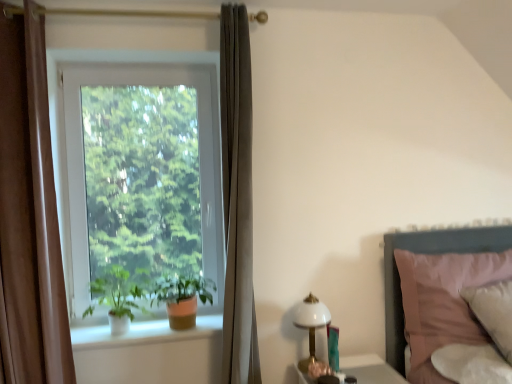
Question: From the image's perspective, is pink fabric bed at right above or below white matte plant at window, the first houseplant when ordered from left to right?

Choices:
 (A) above
 (B) below

Answer: (B)

Question: Is pink fabric bed at right wider or thinner than white matte plant at window, which is the second houseplant in right-to-left order?

Choices:
 (A) wide
 (B) thin

Answer: (B)

Question: Estimate the real-world distances between objects in this image. Which object is farther from the brown velvet curtain at left?

Choices:
 (A) white plastic window at left
 (B) pink fabric bed at right
 (C) green matte plant at window, which ranks as the second houseplant in left-to-right order
 (D) white matte plant at window, the first houseplant when ordered from left to right
 (E) white ceramic window sill at lower left

Answer: (B)

Question: Which object is positioned farthest from the pink fabric bed at right?

Choices:
 (A) white matte plant at window, which is the second houseplant in right-to-left order
 (B) white glossy table at lower right
 (C) white plastic window at left
 (D) green matte plant at window, which ranks as the second houseplant in left-to-right order
 (E) brown velvet curtain at left

Answer: (E)